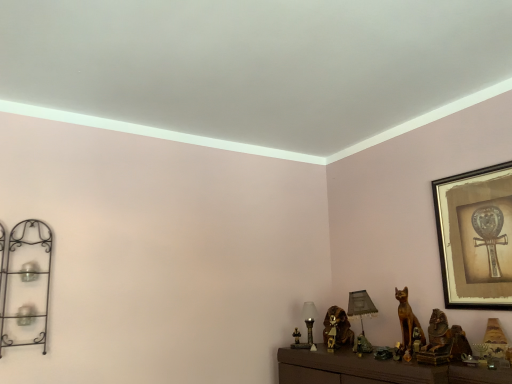
Question: Can you confirm if brown metallic cat at center, the 2th animal from the front, is smaller than gold-framed artwork at upper right?

Choices:
 (A) yes
 (B) no

Answer: (A)

Question: Can you confirm if brown metallic cat at center, which is the 1th animal in left-to-right order, is taller than gold-framed artwork at upper right?

Choices:
 (A) yes
 (B) no

Answer: (B)

Question: From a real-world perspective, is brown metallic cat at center, which is the 1th animal in left-to-right order, physically above gold-framed artwork at upper right?

Choices:
 (A) yes
 (B) no

Answer: (B)

Question: Is brown metallic cat at center, which is the 2th animal from right to left, wider than gold-framed artwork at upper right?

Choices:
 (A) yes
 (B) no

Answer: (A)

Question: From the image's perspective, does brown metallic cat at center, which is counted as the 1th animal, starting from the back, appear higher than gold-framed artwork at upper right?

Choices:
 (A) yes
 (B) no

Answer: (B)

Question: Is brown metallic cat at center, which is the 2th animal from right to left, looking in the opposite direction of gold-framed artwork at upper right?

Choices:
 (A) yes
 (B) no

Answer: (B)

Question: From a real-world perspective, does matte gray lampshade at center, the 2th table lamp viewed from the left, sit lower than brown metallic cat at center, which is the 2th animal from right to left?

Choices:
 (A) yes
 (B) no

Answer: (B)

Question: Does matte gray lampshade at center, the 2th table lamp viewed from the left, have a greater height compared to brown metallic cat at center, which is the 1th animal in left-to-right order?

Choices:
 (A) yes
 (B) no

Answer: (A)

Question: From the image's perspective, is matte gray lampshade at center, the first table lamp when ordered from right to left, located above brown metallic cat at center, which is the 2th animal from right to left?

Choices:
 (A) no
 (B) yes

Answer: (B)

Question: Is matte gray lampshade at center, the first table lamp when ordered from right to left, positioned beyond the bounds of brown metallic cat at center, which is the 1th animal in left-to-right order?

Choices:
 (A) yes
 (B) no

Answer: (A)

Question: Can you confirm if matte gray lampshade at center, the 2th table lamp viewed from the left, is thinner than brown metallic cat at center, which is counted as the 1th animal, starting from the back?

Choices:
 (A) no
 (B) yes

Answer: (B)

Question: Does matte gray lampshade at center, the first table lamp when ordered from right to left, appear on the right side of brown metallic cat at center, which is counted as the 1th animal, starting from the back?

Choices:
 (A) yes
 (B) no

Answer: (A)

Question: Considering the relative positions of matte glass table lamp at center, the 2th table lamp in the right-to-left sequence, and golden wood cat at lower right, arranged as the second animal when viewed from the back, in the image provided, is matte glass table lamp at center, the 2th table lamp in the right-to-left sequence, behind golden wood cat at lower right, arranged as the second animal when viewed from the back,?

Choices:
 (A) no
 (B) yes

Answer: (B)